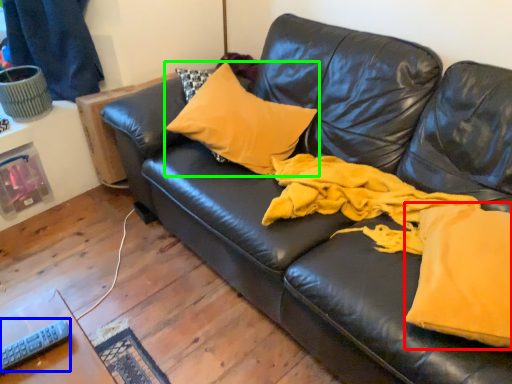
Question: Estimate the real-world distances between objects in this image. Which object is closer to fabric (highlighted by a red box), remote (highlighted by a blue box) or pillow (highlighted by a green box)?

Choices:
 (A) remote
 (B) pillow

Answer: (B)